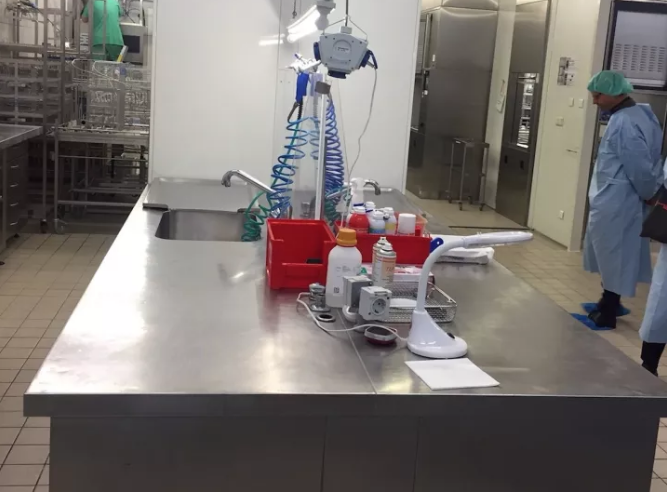
I want to click on tile floor, so click(x=37, y=283), click(x=561, y=274).